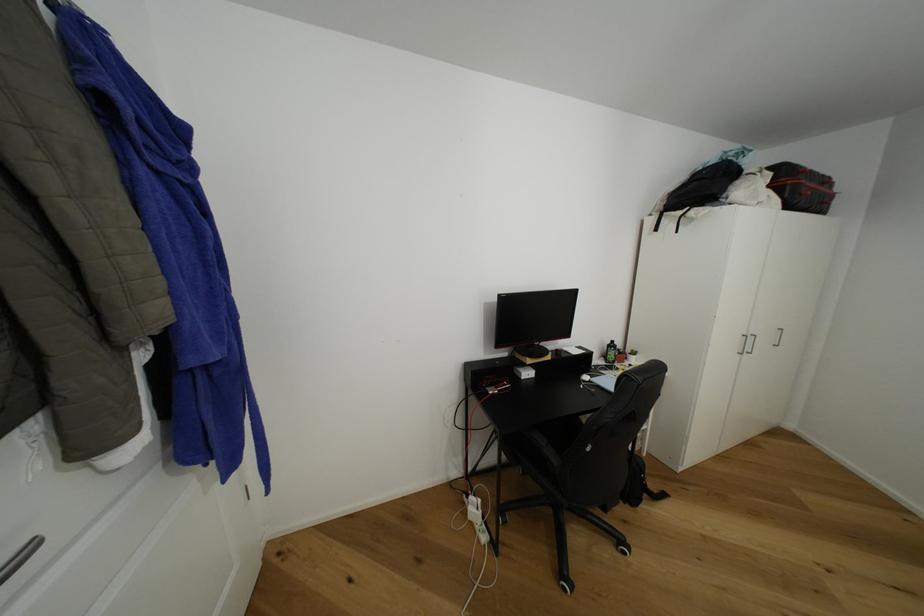
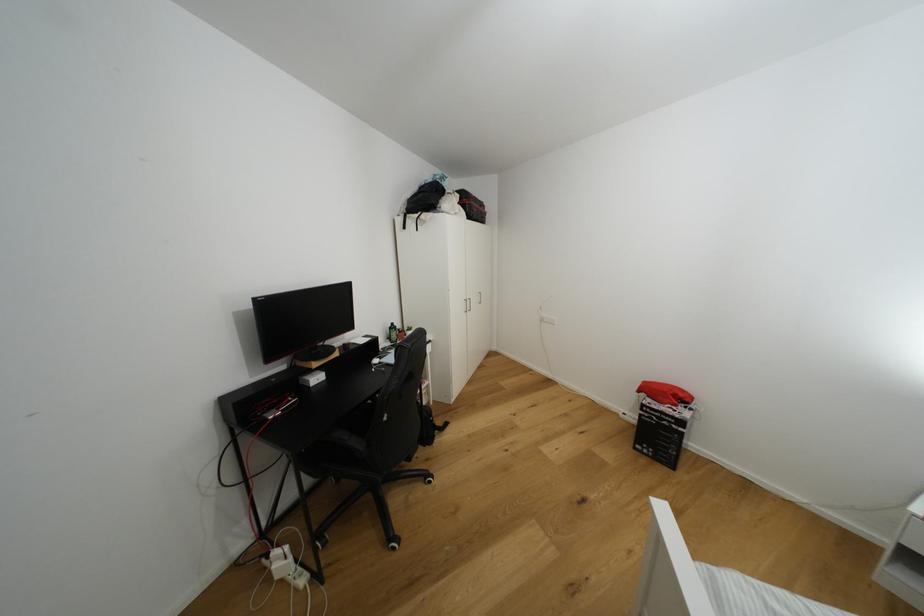
The point at (743, 184) is marked in the first image. Where is the corresponding point in the second image?

(448, 199)